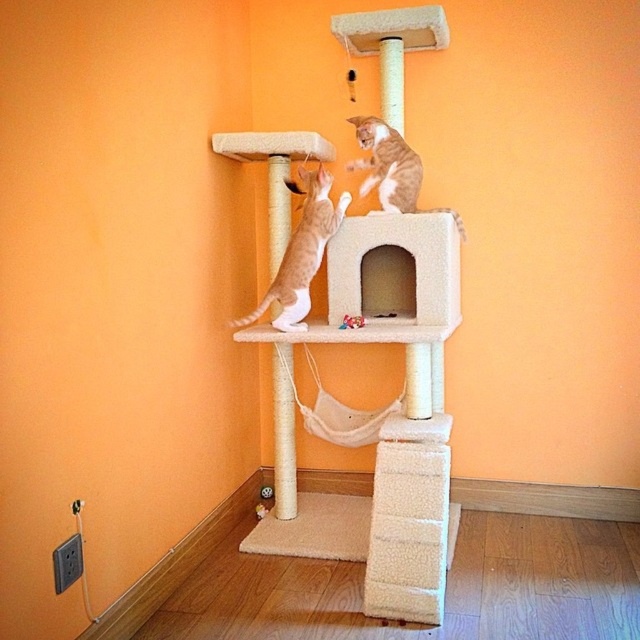
Does point (294, 276) come behind point (371, 124)?

No, (294, 276) is closer to viewer.

Locate an element on the screen. The image size is (640, 640). orange fur cat at center is located at coordinates (301, 253).